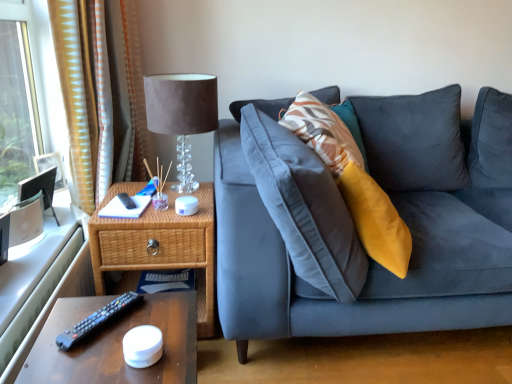
Where is `suede-like fabric lampshade at upper left`? The image size is (512, 384). suede-like fabric lampshade at upper left is located at coordinates (181, 114).

What do you see at coordinates (159, 245) in the screenshot? I see `woven wood nightstand at left` at bounding box center [159, 245].

What are the coordinates of `woven wood nightstand at left` in the screenshot? It's located at (159, 245).

This screenshot has height=384, width=512. I want to click on black plastic remote at lower left, so click(97, 320).

Is woven wood nightstand at left to the left or to the right of suede-like fabric lampshade at upper left in the image?

Clearly, woven wood nightstand at left is on the left of suede-like fabric lampshade at upper left in the image.

Is woven wood nightstand at left not close to suede-like fabric lampshade at upper left?

Actually, woven wood nightstand at left and suede-like fabric lampshade at upper left are a little close together.

In the scene shown: How many degrees apart are the facing directions of woven wood nightstand at left and suede-like fabric lampshade at upper left?

There is a 6.59-degree angle between the facing directions of woven wood nightstand at left and suede-like fabric lampshade at upper left.

From a real-world perspective, which object rests below the other?

woven wood nightstand at left.

From a real-world perspective, is yellow striped fabric at left physically below black plastic remote at lower left?

Incorrect, from a real-world perspective, yellow striped fabric at left is higher than black plastic remote at lower left.

Does yellow striped fabric at left come in front of black plastic remote at lower left?

No, yellow striped fabric at left is further to the viewer.

From the image's perspective, would you say yellow striped fabric at left is shown under black plastic remote at lower left?

No.

Based on the photo, does yellow striped fabric at left have a greater width compared to black plastic remote at lower left?

Yes.

Is yellow striped fabric at left placed right next to suede-like fabric lampshade at upper left?

No.

Considering the points (70, 54) and (182, 180), which point is in front, point (70, 54) or point (182, 180)?

Positioned in front is point (70, 54).

Is yellow striped fabric at left facing away from suede-like fabric lampshade at upper left?

yellow striped fabric at left is not turned away from suede-like fabric lampshade at upper left.

From the image's perspective, which object appears higher, yellow striped fabric at left or suede-like fabric lampshade at upper left?

yellow striped fabric at left, from the image's perspective.

Which is in front, yellow striped fabric at left or brown wooden table at lower left?

brown wooden table at lower left is closer to the camera.

In terms of size, does yellow striped fabric at left appear bigger or smaller than brown wooden table at lower left?

yellow striped fabric at left is bigger than brown wooden table at lower left.

From a real-world perspective, who is located higher, yellow striped fabric at left or brown wooden table at lower left?

yellow striped fabric at left is physically above.

From the image's perspective, is yellow striped fabric at left below brown wooden table at lower left?

No, from the image's perspective, yellow striped fabric at left is not below brown wooden table at lower left.

Is black plastic remote at lower left positioned far away from brown wooden table at lower left?

That's not correct — black plastic remote at lower left is a little close to brown wooden table at lower left.

Considering the sizes of black plastic remote at lower left and brown wooden table at lower left in the image, is black plastic remote at lower left bigger or smaller than brown wooden table at lower left?

In the image, black plastic remote at lower left appears to be smaller than brown wooden table at lower left.

Considering the relative sizes of black plastic remote at lower left and brown wooden table at lower left in the image provided, is black plastic remote at lower left taller than brown wooden table at lower left?

Incorrect, the height of black plastic remote at lower left is not larger of that of brown wooden table at lower left.

Is brown wooden table at lower left closer to camera compared to woven wood nightstand at left?

Yes.

Is brown wooden table at lower left spatially inside woven wood nightstand at left, or outside of it?

brown wooden table at lower left is not inside woven wood nightstand at left, it's outside.

From a real-world perspective, is brown wooden table at lower left above or below woven wood nightstand at left?

Clearly, from a real-world perspective, brown wooden table at lower left is above woven wood nightstand at left.

Is point (109, 343) closer to viewer compared to point (201, 325)?

That is True.

Looking at this image, is brown wooden table at lower left beside black plastic remote at lower left?

Yes, brown wooden table at lower left is with black plastic remote at lower left.

From the image's perspective, relative to black plastic remote at lower left, is brown wooden table at lower left above or below?

brown wooden table at lower left is below black plastic remote at lower left.

Is brown wooden table at lower left bigger than black plastic remote at lower left?

Yes.

Considering the relative sizes of brown wooden table at lower left and black plastic remote at lower left in the image provided, is brown wooden table at lower left shorter than black plastic remote at lower left?

In fact, brown wooden table at lower left may be taller than black plastic remote at lower left.

The width and height of the screenshot is (512, 384). What are the coordinates of `nightstand lying on the left of suede-like fabric lampshade at upper left` in the screenshot? It's located at (159, 245).

Identify the location of remote that is on the right side of yellow striped fabric at left. (97, 320).

Which object lies further to the anchor point yellow striped fabric at left, suede-like fabric lampshade at upper left or woven wood nightstand at left?

Among the two, woven wood nightstand at left is located further to yellow striped fabric at left.

From the image, which object appears to be nearer to woven wood nightstand at left, black plastic remote at lower left or yellow striped fabric at left?

Based on the image, yellow striped fabric at left appears to be nearer to woven wood nightstand at left.

Looking at the image, which one is located closer to woven wood nightstand at left, brown wooden table at lower left or yellow striped fabric at left?

yellow striped fabric at left is positioned closer to the anchor woven wood nightstand at left.

Estimate the real-world distances between objects in this image. Which object is further from woven wood nightstand at left, black plastic remote at lower left or brown wooden table at lower left?

Among the two, brown wooden table at lower left is located further to woven wood nightstand at left.

Looking at the image, which one is located further to suede-like fabric lampshade at upper left, yellow striped fabric at left or woven wood nightstand at left?

woven wood nightstand at left is further to suede-like fabric lampshade at upper left.

Estimate the real-world distances between objects in this image. Which object is further from black plastic remote at lower left, yellow striped fabric at left or brown wooden table at lower left?

yellow striped fabric at left lies further to black plastic remote at lower left than the other object.

When comparing their distances from black plastic remote at lower left, does suede-like fabric lampshade at upper left or brown wooden table at lower left seem closer?

The object closer to black plastic remote at lower left is brown wooden table at lower left.

Based on their spatial positions, is suede-like fabric lampshade at upper left or yellow striped fabric at left further from brown wooden table at lower left?

Among the two, yellow striped fabric at left is located further to brown wooden table at lower left.

Where is `remote between yellow striped fabric at left and brown wooden table at lower left vertically`? The image size is (512, 384). remote between yellow striped fabric at left and brown wooden table at lower left vertically is located at coordinates (97, 320).

At what (x,y) coordinates should I click in order to perform the action: click on nightstand that lies between suede-like fabric lampshade at upper left and brown wooden table at lower left from top to bottom. Please return your answer as a coordinate pair (x, y). Looking at the image, I should click on (159, 245).

This screenshot has height=384, width=512. In order to click on table lamp between yellow striped fabric at left and brown wooden table at lower left vertically in this screenshot , I will do `click(181, 114)`.

At what (x,y) coordinates should I click in order to perform the action: click on nightstand that lies between yellow striped fabric at left and black plastic remote at lower left from top to bottom. Please return your answer as a coordinate pair (x, y). This screenshot has height=384, width=512. Looking at the image, I should click on (159, 245).